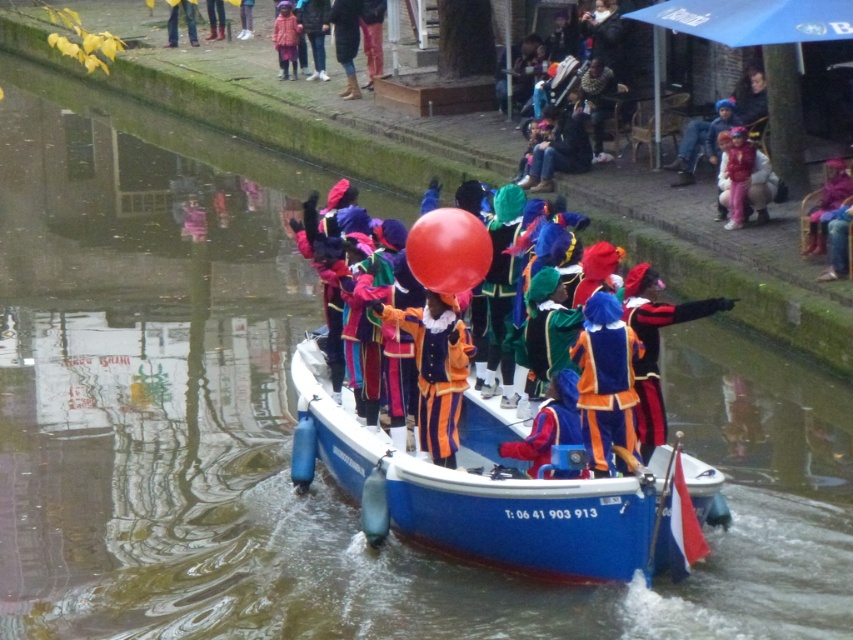
You are standing on the canal bank and want to take a photo of the point at coordinates (293, 49). Your camera has a focal length of 50mm and you want to ensure the subject is in focus. What is the minimum distance you need to be from the point to capture it clearly?

The point at coordinates (293, 49) is 124.02 feet from the viewer. To ensure the subject is in focus, you need to be at least 124.02 feet away from the point.

You are a photographer standing on the dock watching the canal parade. You want to take a photo of the blue glossy boat at center and the velvet orange costume at center. Which object should you focus on first to ensure both are in the frame?

The blue glossy boat at center is in front of the velvet orange costume at center, so you should focus on the blue glossy boat at center first to ensure both are in the frame.